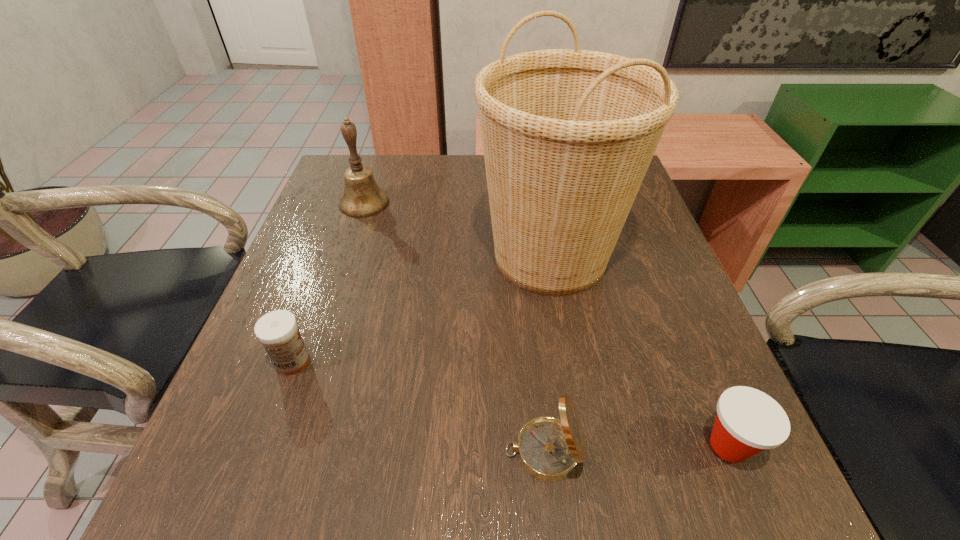
I want to click on vacant space located 0.200m on the front of the medicine, so click(x=241, y=503).

The image size is (960, 540). I want to click on vacant space situated on the left of the Dixie cup, so click(x=638, y=446).

Where is `object at the far edge`? The height and width of the screenshot is (540, 960). object at the far edge is located at coordinates tap(362, 197).

At what (x,y) coordinates should I click in order to perform the action: click on compass present at the near edge. Please return your answer as a coordinate pair (x, y). This screenshot has height=540, width=960. Looking at the image, I should click on (548, 448).

Where is `Dixie cup that is at the near edge`? Dixie cup that is at the near edge is located at coordinates (748, 421).

Locate an element on the screen. The width and height of the screenshot is (960, 540). bell located at the left edge is located at coordinates (362, 197).

The height and width of the screenshot is (540, 960). In order to click on medicine that is positioned at the left edge in this screenshot , I will do `click(278, 331)`.

The width and height of the screenshot is (960, 540). I want to click on basket that is at the right edge, so click(568, 135).

In order to click on Dixie cup that is positioned at the right edge in this screenshot , I will do `click(748, 421)`.

Identify the location of object present at the far left corner. [x=362, y=197].